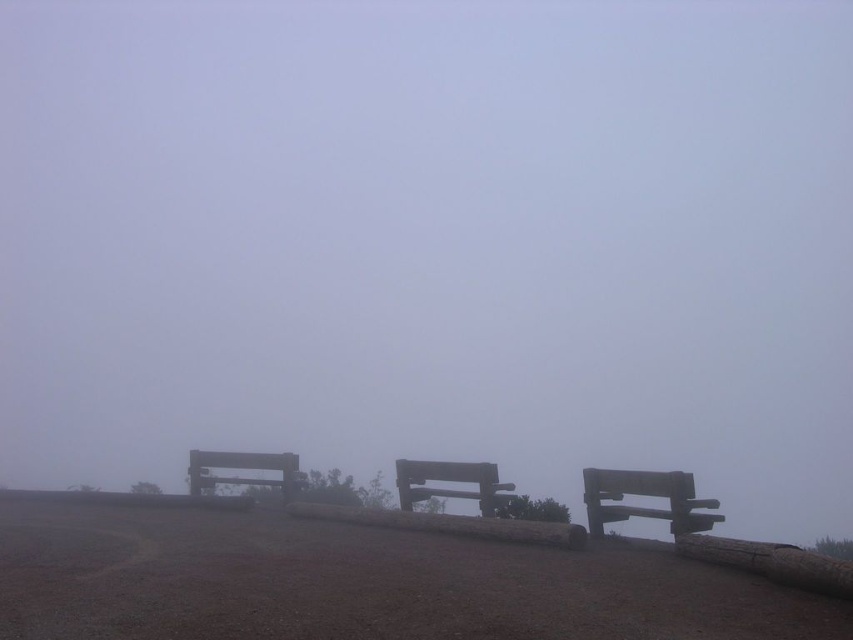
Who is higher up, wooden bench at right or wooden bench at center?

wooden bench at right is above.

Find the location of a particular element. Image resolution: width=853 pixels, height=640 pixels. wooden bench at right is located at coordinates (647, 496).

How far apart are smooth gray bench at center and wooden bench at center?

A distance of 7.23 feet exists between smooth gray bench at center and wooden bench at center.

Which is above, smooth gray bench at center or wooden bench at center?

smooth gray bench at center is higher up.

Image resolution: width=853 pixels, height=640 pixels. Find the location of `smooth gray bench at center`. smooth gray bench at center is located at coordinates (450, 481).

The width and height of the screenshot is (853, 640). Identify the location of smooth gray bench at center. (450, 481).

Measure the distance between wooden bench at right and camera.

wooden bench at right is 6.56 meters away from camera.

At what (x,y) coordinates should I click in order to perform the action: click on wooden bench at right. Please return your answer as a coordinate pair (x, y). Looking at the image, I should click on (647, 496).

This screenshot has height=640, width=853. Find the location of `wooden bench at right`. wooden bench at right is located at coordinates (647, 496).